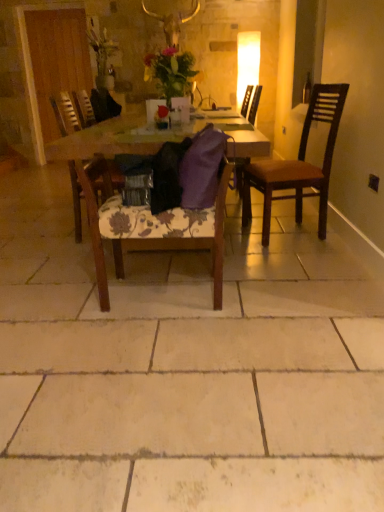
The width and height of the screenshot is (384, 512). I want to click on free space between wooden table at center and wooden chair at center, which ranks as the second chair in left-to-right order, so click(x=158, y=290).